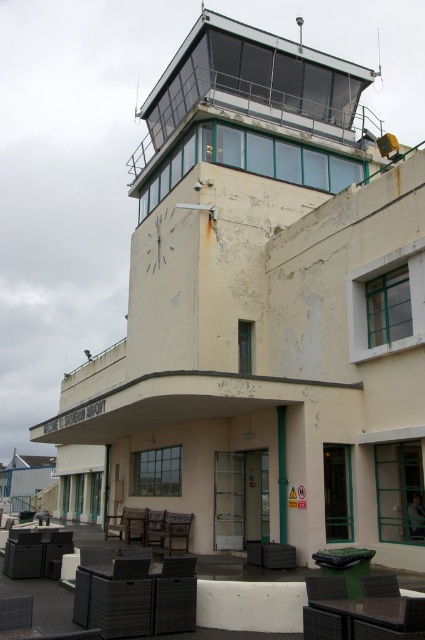
Question: Which of these objects is positioned farthest from the matte black chair at lower left?

Choices:
 (A) brown woven chair at lower center
 (B) brown wooden chair at lower center

Answer: (B)

Question: Is matte black chair at lower left thinner than brown woven chair at lower center?

Choices:
 (A) yes
 (B) no

Answer: (A)

Question: Does brown woven chair at lower center lie in front of brown wooden chair at lower center?

Choices:
 (A) no
 (B) yes

Answer: (B)

Question: Which object appears farthest from the camera in this image?

Choices:
 (A) brown wooden chair at lower center
 (B) brown woven chair at lower center
 (C) matte black chair at lower left

Answer: (A)

Question: Based on their relative distances, which object is farther from the matte black chair at lower left?

Choices:
 (A) brown woven chair at lower center
 (B) brown wooden chair at lower center

Answer: (B)

Question: Can you confirm if brown woven chair at lower center is positioned above brown wooden chair at lower center?

Choices:
 (A) yes
 (B) no

Answer: (A)